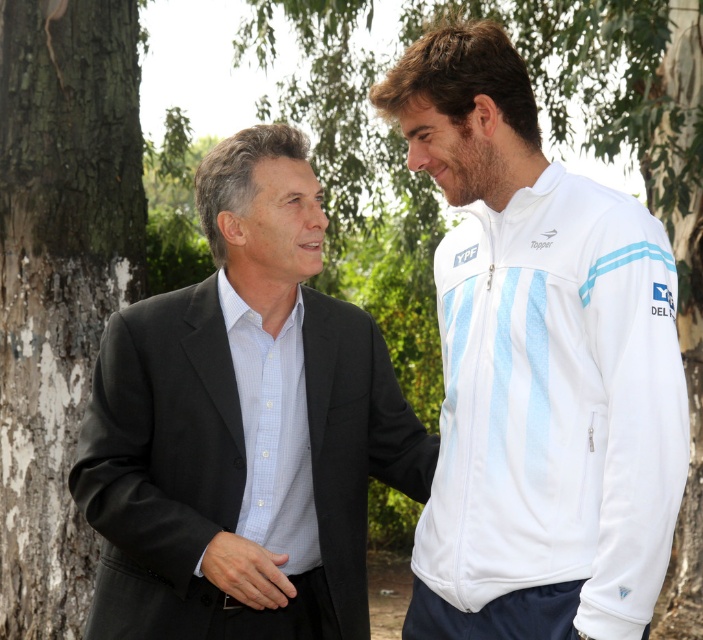
You are a photographer who needs to capture a closeup shot of the smooth skin hand at center without including the white fabric jacket at right in the frame. Based on their positions, is this possible?

The white fabric jacket at right is to the right of the smooth skin hand at center, so if you position the camera to focus on the smooth skin hand at center and frame the shot to exclude the right side, it should be possible to capture the closeup without including the white fabric jacket at right.

You are a photographer trying to capture a portrait of the two people in the scene. To ensure the background is clear, you need to know if the white fabric jacket at right is positioned to the right of the rough bark tree at left. Can you confirm this?

Yes, the white fabric jacket at right is positioned to the right of the rough bark tree at left according to the description.